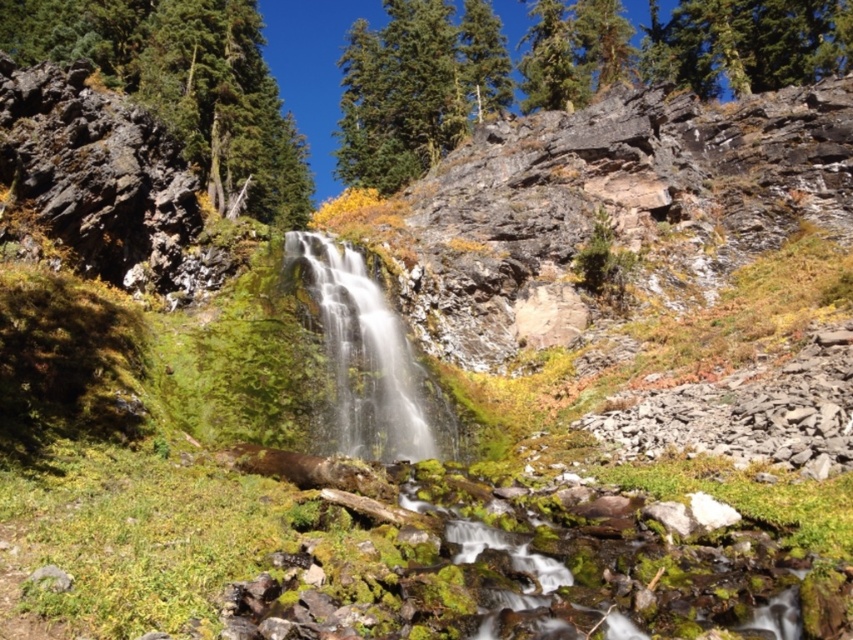
You are standing at the base of the waterfall and want to take a photo of both the green rough bark tree at upper left and the white frothy water at center. Which object should you position to the left side of your camera frame to include both in the shot?

You should position the green rough bark tree at upper left to the left side of your camera frame since it is already to the left of the white frothy water at center, allowing both to be captured in the shot.